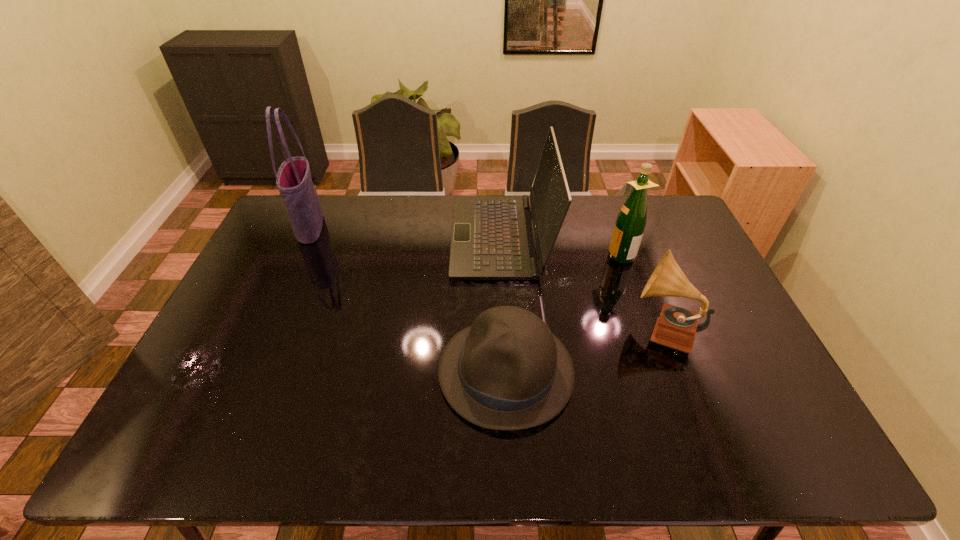
At what (x,y) coordinates should I click in order to perform the action: click on free spot located on the screen of the laptop computer. Please return your answer as a coordinate pair (x, y). Looking at the image, I should click on (380, 237).

The width and height of the screenshot is (960, 540). Identify the location of vacant space situated 0.180m on the screen of the laptop computer. (400, 237).

Where is `free location located 0.160m on the screen of the laptop computer`? The image size is (960, 540). free location located 0.160m on the screen of the laptop computer is located at coordinates (406, 237).

At what (x,y) coordinates should I click in order to perform the action: click on vacant space located 0.120m on the horn of the second shortest object. Please return your answer as a coordinate pair (x, y). Looking at the image, I should click on (586, 329).

The width and height of the screenshot is (960, 540). I want to click on free space located on the horn of the second shortest object, so click(x=503, y=329).

Where is `vacant space situated 0.270m on the horn of the second shortest object`? The width and height of the screenshot is (960, 540). vacant space situated 0.270m on the horn of the second shortest object is located at coordinates (532, 329).

Where is `free point located 0.290m on the front-facing side of the shortest object`? Image resolution: width=960 pixels, height=540 pixels. free point located 0.290m on the front-facing side of the shortest object is located at coordinates (326, 371).

What are the coordinates of `free space located 0.230m on the front-facing side of the shortest object` in the screenshot? It's located at (349, 371).

The width and height of the screenshot is (960, 540). In order to click on free spot located 0.230m on the front-facing side of the shortest object in this screenshot , I will do `click(349, 371)`.

I want to click on tote bag present at the far edge, so [293, 179].